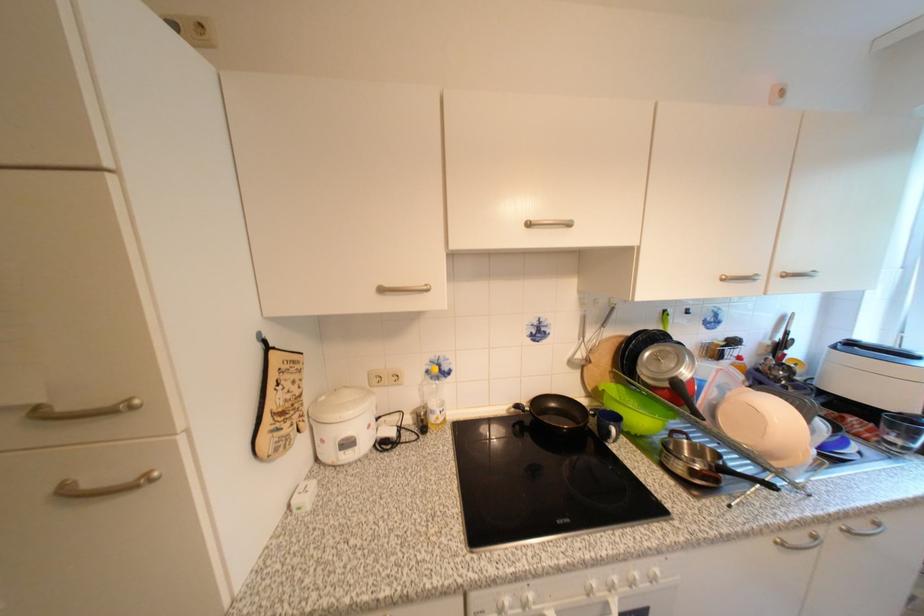
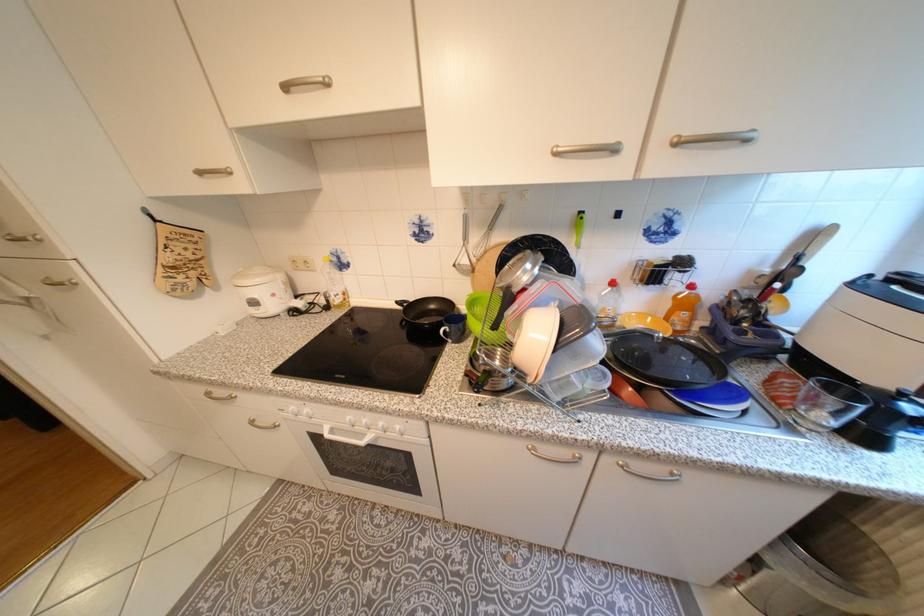
Locate, in the second image, the point that corresponds to (733,284) in the first image.

(565, 160)